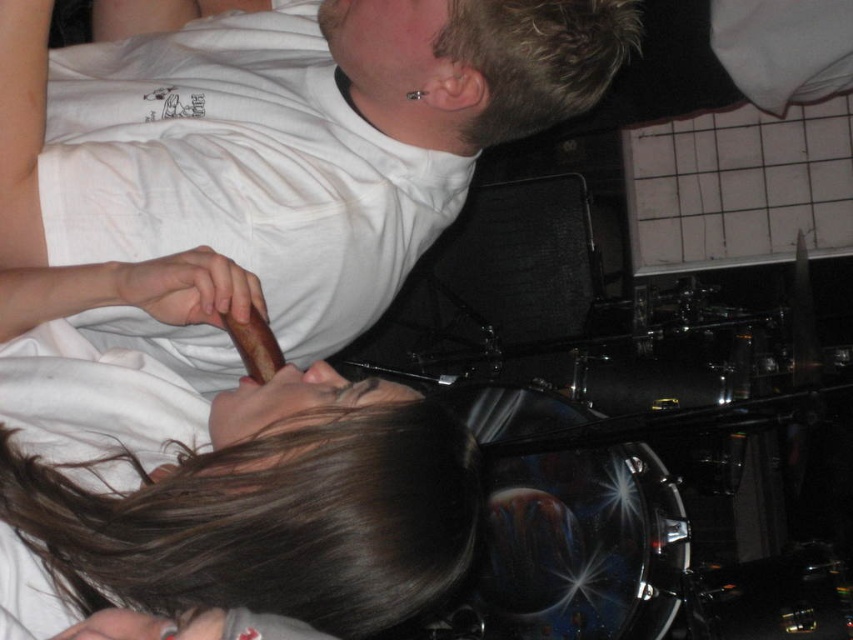
Question: Estimate the real-world distances between objects in this image. Which object is farther from the brown hair at upper center?

Choices:
 (A) white matte t-shirt at upper center
 (B) blonde hair at upper center

Answer: (B)

Question: Can you confirm if white matte t-shirt at upper center is bigger than brown hair at upper center?

Choices:
 (A) yes
 (B) no

Answer: (A)

Question: Which point is closer to the camera?

Choices:
 (A) blonde hair at upper center
 (B) white matte t-shirt at upper center
 (C) brown hair at upper center

Answer: (C)

Question: Is brown hair at upper center wider than blonde hair at upper center?

Choices:
 (A) yes
 (B) no

Answer: (A)

Question: Considering the real-world distances, which object is farthest from the brown hair at upper center?

Choices:
 (A) white matte t-shirt at upper center
 (B) blonde hair at upper center

Answer: (B)

Question: Can you confirm if white matte t-shirt at upper center is positioned above brown hair at upper center?

Choices:
 (A) no
 (B) yes

Answer: (B)